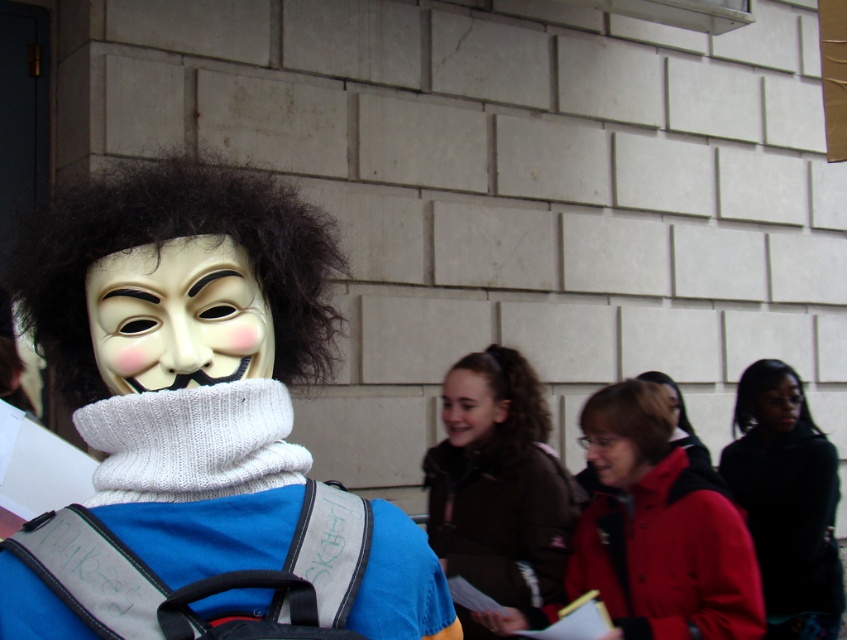
You are a photographer trying to capture the person in the image. The camera you are using has a limited focus range. If you focus on the matte black mask at center, will the brown curly hair at lower center also be in focus?

The brown curly hair at lower center is wider than the matte black mask at center, so focusing on the matte black mask at center may not ensure the brown curly hair at lower center is in focus due to the difference in their sizes and positions.

You are a photographer taking a picture of the scene. You notice the black matte jacket at lower right and the matte plastic mask at center. Which object should you focus on to ensure the other is in the background?

You should focus on the black matte jacket at lower right because it is closer to the viewer than the matte plastic mask at center, so focusing on it will place the matte plastic mask at center in the background.